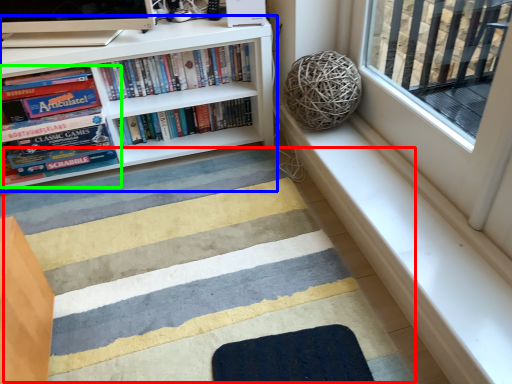
Question: Based on their relative distances, which object is nearer to doormat (highlighted by a red box)? Choose from bookcase (highlighted by a blue box) and book (highlighted by a green box).

Choices:
 (A) bookcase
 (B) book

Answer: (A)